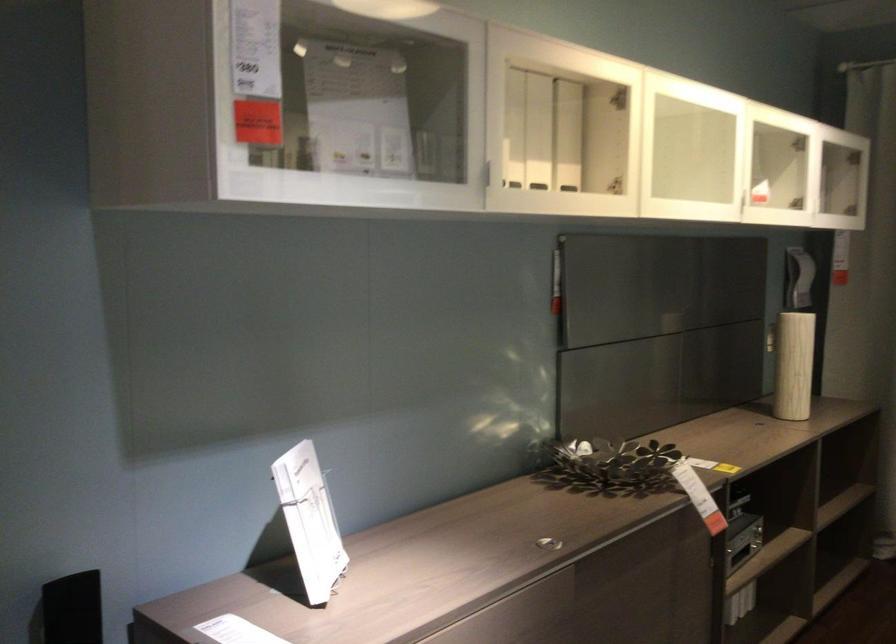
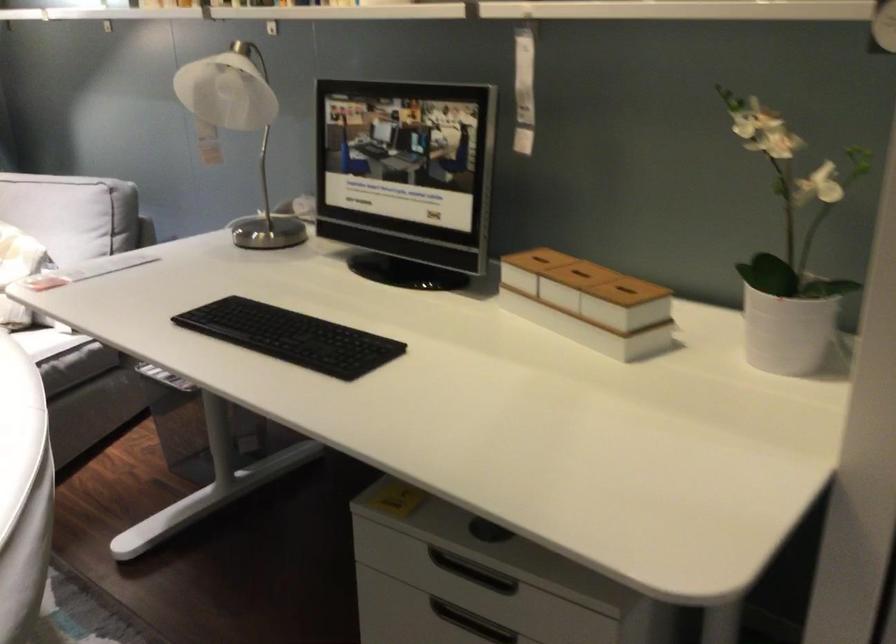
The first image is from the beginning of the video and the second image is from the end. How did the camera likely rotate when shooting the video?

The camera rotated toward right-down.